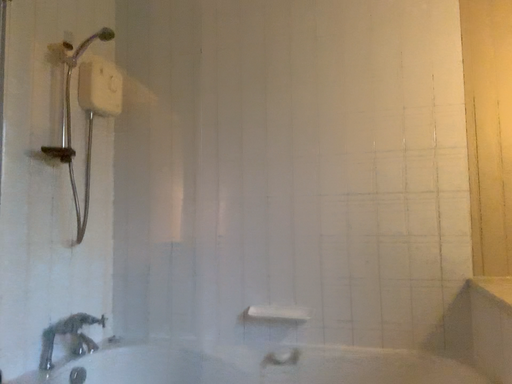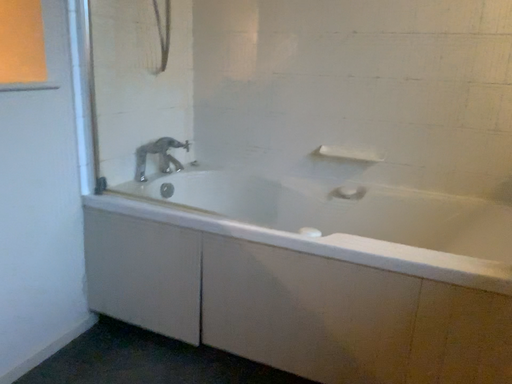
Question: How did the camera likely rotate when shooting the video?

Choices:
 (A) rotated left
 (B) rotated right

Answer: (A)